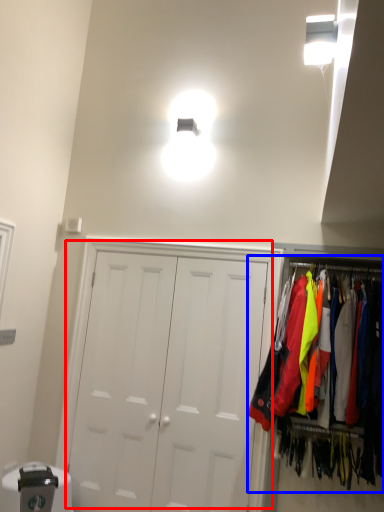
Question: Which of the following is the closest to the observer, door (highlighted by a red box) or closet (highlighted by a blue box)?

Choices:
 (A) door
 (B) closet

Answer: (B)